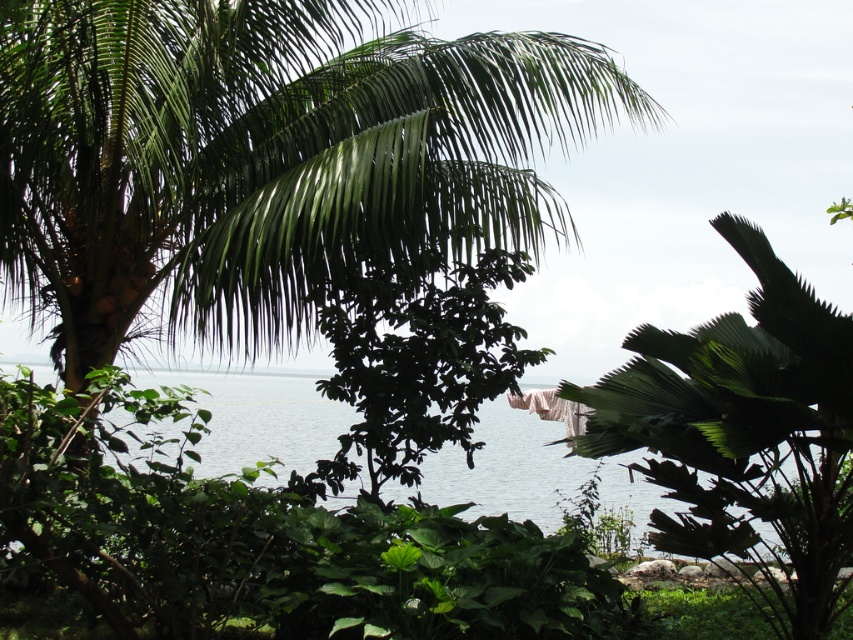
Between green leafy coconut tree at upper left and clear blue water at center, which one is positioned higher?

green leafy coconut tree at upper left is above.

Between green leafy coconut tree at upper left and clear blue water at center, which one appears on the right side from the viewer's perspective?

clear blue water at center is more to the right.

Who is more distant from viewer, (469, 160) or (640, 492)?

Positioned behind is point (640, 492).

This screenshot has height=640, width=853. I want to click on green leafy coconut tree at upper left, so click(x=264, y=157).